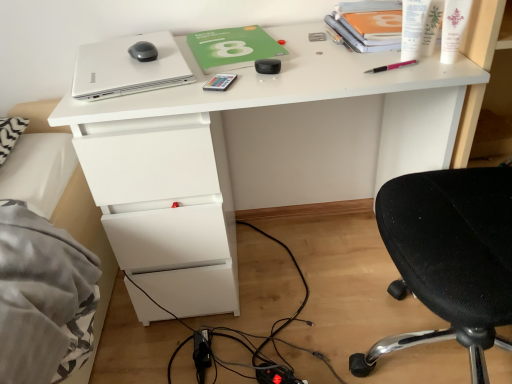
Locate an element on the screen. The height and width of the screenshot is (384, 512). free area in between metallic rectangular object at center, the 1th stationery in the left-to-right sequence, and pink plastic pen at upper right, the second stationery in the left-to-right sequence is located at coordinates (302, 76).